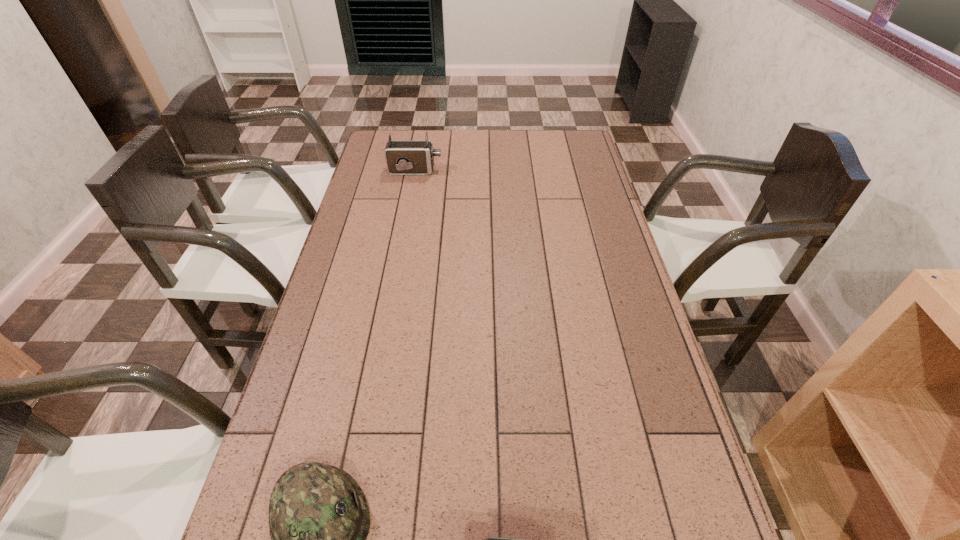
Image resolution: width=960 pixels, height=540 pixels. Find the location of `the farthest object`. the farthest object is located at coordinates (403, 157).

At what (x,y) coordinates should I click in order to perform the action: click on the farther camcorder. Please return your answer as a coordinate pair (x, y). Image resolution: width=960 pixels, height=540 pixels. Looking at the image, I should click on (403, 157).

Image resolution: width=960 pixels, height=540 pixels. Find the location of `free space located 0.310m at the lens of the farthest object`. free space located 0.310m at the lens of the farthest object is located at coordinates (520, 171).

At what (x,y) coordinates should I click in order to perform the action: click on object that is positioned at the left edge. Please return your answer as a coordinate pair (x, y). The width and height of the screenshot is (960, 540). Looking at the image, I should click on (403, 157).

This screenshot has width=960, height=540. What are the coordinates of `free space at the far edge of the desktop` in the screenshot? It's located at (539, 151).

In order to click on vacant space at the left edge of the desktop in this screenshot , I will do `click(378, 249)`.

In the image, there is a desktop. Where is `vacant area at the right edge`? This screenshot has height=540, width=960. vacant area at the right edge is located at coordinates (571, 230).

You are a GUI agent. You are given a task and a screenshot of the screen. Output one action in this format:
    pyautogui.click(x=<x>, y=<y>)
    Task: Click on the object that stands as the closest to the left camcorder
    
    Given the screenshot: What is the action you would take?
    pyautogui.click(x=319, y=518)

Point out which object is positioned as the nearest to the nearer camcorder. Please provide its 2D coordinates. Your answer should be formatted as a tuple, i.e. [(x, y)], where the tuple contains the x and y coordinates of a point satisfying the conditions above.

[(319, 518)]